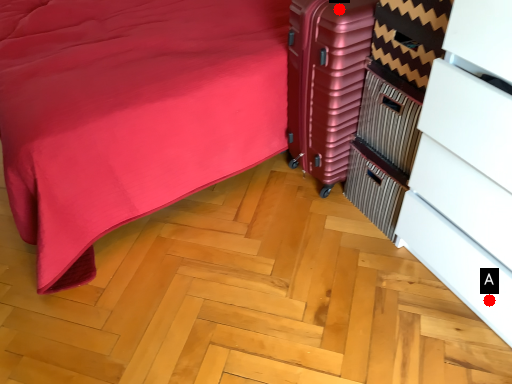
Question: Two points are circled on the image, labeled by A and B beside each circle. Which of the following is the farthest from the observer?

Choices:
 (A) A is further
 (B) B is further

Answer: (B)